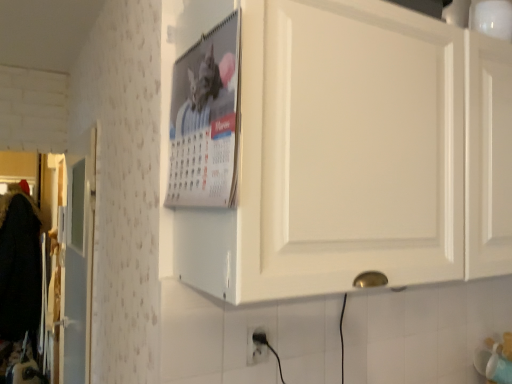
Question: Could you tell me if white matte cabinet at upper center is facing metallic silver calendar at upper center?

Choices:
 (A) no
 (B) yes

Answer: (A)

Question: Is white matte cabinet at upper center positioned with its back to metallic silver calendar at upper center?

Choices:
 (A) no
 (B) yes

Answer: (A)

Question: Is white matte cabinet at upper center closer to the viewer compared to metallic silver calendar at upper center?

Choices:
 (A) yes
 (B) no

Answer: (A)

Question: Is metallic silver calendar at upper center completely or partially inside white matte cabinet at upper center?

Choices:
 (A) no
 (B) yes

Answer: (A)

Question: Is white matte cabinet at upper center bigger than metallic silver calendar at upper center?

Choices:
 (A) no
 (B) yes

Answer: (B)

Question: Considering the relative sizes of white matte cabinet at upper center and metallic silver calendar at upper center in the image provided, is white matte cabinet at upper center shorter than metallic silver calendar at upper center?

Choices:
 (A) no
 (B) yes

Answer: (A)

Question: Is white matte cabinet at upper center next to white plastic electric outlet at lower center?

Choices:
 (A) no
 (B) yes

Answer: (A)

Question: Is white matte cabinet at upper center to the left of white plastic electric outlet at lower center from the viewer's perspective?

Choices:
 (A) no
 (B) yes

Answer: (A)

Question: Is white matte cabinet at upper center thinner than white plastic electric outlet at lower center?

Choices:
 (A) no
 (B) yes

Answer: (A)

Question: Does white matte cabinet at upper center come behind white plastic electric outlet at lower center?

Choices:
 (A) no
 (B) yes

Answer: (A)

Question: Is white matte cabinet at upper center outside of white plastic electric outlet at lower center?

Choices:
 (A) no
 (B) yes

Answer: (B)

Question: Is white matte cabinet at upper center smaller than white plastic electric outlet at lower center?

Choices:
 (A) yes
 (B) no

Answer: (B)

Question: Is metallic silver calendar at upper center positioned behind white plastic electric outlet at lower center?

Choices:
 (A) yes
 (B) no

Answer: (B)